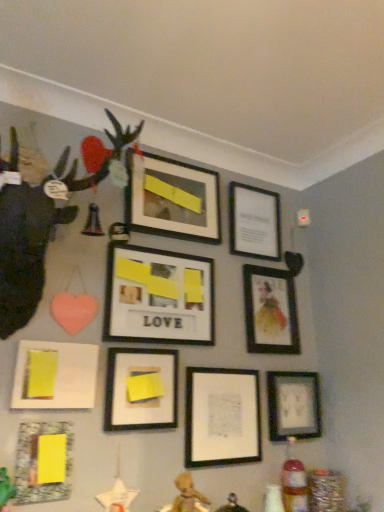
At what (x,y) coordinates should I click in order to perform the action: click on matte paper picture frame at center, which ranks as the 6th picture frame in right-to-left order. Please return your answer as a coordinate pair (x, y). The image size is (384, 512). Looking at the image, I should click on (158, 297).

The image size is (384, 512). I want to click on matte black figurine at left, so click(x=42, y=228).

From the image's perspective, which is below, matte black picture frame at upper center, the seventh picture frame viewed from the left, or matte black picture frame at center, which is counted as the 7th picture frame, starting from the right?

From the image's view, matte black picture frame at center, which is counted as the 7th picture frame, starting from the right, is below.

Considering the relative sizes of matte black picture frame at upper center, the seventh picture frame viewed from the left, and matte black picture frame at center, which is counted as the 7th picture frame, starting from the right, in the image provided, is matte black picture frame at upper center, the seventh picture frame viewed from the left, bigger than matte black picture frame at center, which is counted as the 7th picture frame, starting from the right,?

Correct, matte black picture frame at upper center, the seventh picture frame viewed from the left, is larger in size than matte black picture frame at center, which is counted as the 7th picture frame, starting from the right.

Which point is more distant from viewer, (258, 191) or (173, 370)?

The point (258, 191) is farther from the camera.

I want to click on the 6th picture frame behind when counting from the matte black picture frame at center, which is counted as the 7th picture frame, starting from the right, so click(x=254, y=222).

Is matte black figurine at left wider or thinner than matte glass picture frame at lower left, which ranks as the 9th picture frame in right-to-left order?

matte black figurine at left is wider than matte glass picture frame at lower left, which ranks as the 9th picture frame in right-to-left order.

From a real-world perspective, relative to matte glass picture frame at lower left, which ranks as the 9th picture frame in right-to-left order, is matte black figurine at left vertically above or below?

matte black figurine at left is situated higher than matte glass picture frame at lower left, which ranks as the 9th picture frame in right-to-left order, in the real world.

Are matte black figurine at left and matte glass picture frame at lower left, which ranks as the 9th picture frame in right-to-left order, beside each other?

No, matte black figurine at left is not making contact with matte glass picture frame at lower left, which ranks as the 9th picture frame in right-to-left order.

Is matte black figurine at left turned away from matte glass picture frame at lower left, which ranks as the 9th picture frame in right-to-left order?

No.

Between matte black picture frame at lower right, the ninth picture frame when ordered from left to right, and matte black picture frame at upper center, the seventh picture frame viewed from the left, which one has larger size?

With larger size is matte black picture frame at upper center, the seventh picture frame viewed from the left.

From the image's perspective, would you say matte black picture frame at lower right, which is the first picture frame in right-to-left order, is positioned over matte black picture frame at upper center, which is the 3th picture frame in right-to-left order?

No, from the image's perspective, matte black picture frame at lower right, which is the first picture frame in right-to-left order, is not on top of matte black picture frame at upper center, which is the 3th picture frame in right-to-left order.

Considering the positions of objects matte black picture frame at lower right, the ninth picture frame when ordered from left to right, and matte black picture frame at upper center, the seventh picture frame viewed from the left, in the image provided, who is in front, matte black picture frame at lower right, the ninth picture frame when ordered from left to right, or matte black picture frame at upper center, the seventh picture frame viewed from the left,?

matte black picture frame at lower right, the ninth picture frame when ordered from left to right, is closer to the camera.

Is matte black picture frame at upper center, the seventh picture frame viewed from the left, at the back of matte black picture frame at lower right, which is the first picture frame in right-to-left order?

No, matte black picture frame at lower right, which is the first picture frame in right-to-left order,'s orientation is not away from matte black picture frame at upper center, the seventh picture frame viewed from the left.

Based on their sizes in the image, would you say matte black picture frame at lower right, which is the first picture frame in right-to-left order, is bigger or smaller than matte black picture frame at center, which is the 4th picture frame in right-to-left order?

In the image, matte black picture frame at lower right, which is the first picture frame in right-to-left order, appears to be larger than matte black picture frame at center, which is the 4th picture frame in right-to-left order.

Is matte black picture frame at lower right, which is the first picture frame in right-to-left order, to the left of matte black picture frame at center, which is the 4th picture frame in right-to-left order, from the viewer's perspective?

No.

Which of these two, matte black picture frame at lower right, the ninth picture frame when ordered from left to right, or matte black picture frame at center, which is the 4th picture frame in right-to-left order, is thinner?

matte black picture frame at center, which is the 4th picture frame in right-to-left order.

What's the angular difference between matte black picture frame at lower right, the ninth picture frame when ordered from left to right, and matte black picture frame at center, arranged as the 6th picture frame when viewed from the left,'s facing directions?

The angular difference between matte black picture frame at lower right, the ninth picture frame when ordered from left to right, and matte black picture frame at center, arranged as the 6th picture frame when viewed from the left, is 0.811 degrees.

Does matte black picture frame at lower right, which is the first picture frame in right-to-left order, turn towards white matte picture frame at lower left, which is the 2th picture frame in left-to-right order?

No, matte black picture frame at lower right, which is the first picture frame in right-to-left order, is not turned towards white matte picture frame at lower left, which is the 2th picture frame in left-to-right order.

Between matte black picture frame at lower right, which is the first picture frame in right-to-left order, and white matte picture frame at lower left, which is the 2th picture frame in left-to-right order, which one has smaller width?

With smaller width is matte black picture frame at lower right, which is the first picture frame in right-to-left order.

From the image's perspective, does matte black picture frame at lower right, which is the first picture frame in right-to-left order, appear lower than white matte picture frame at lower left, which is the 2th picture frame in left-to-right order?

Correct, matte black picture frame at lower right, which is the first picture frame in right-to-left order, appears lower than white matte picture frame at lower left, which is the 2th picture frame in left-to-right order, in the image.

Could you measure the distance between matte black picture frame at upper right, placed as the 2th picture frame when sorted from right to left, and matte black picture frame at upper center, which is the 3th picture frame in right-to-left order?

matte black picture frame at upper right, placed as the 2th picture frame when sorted from right to left, is 8.75 inches away from matte black picture frame at upper center, which is the 3th picture frame in right-to-left order.

From a real-world perspective, between matte black picture frame at upper right, acting as the eighth picture frame starting from the left, and matte black picture frame at upper center, which is the 3th picture frame in right-to-left order, who is vertically higher?

In real-world perspective, matte black picture frame at upper center, which is the 3th picture frame in right-to-left order, is above.

Which object is closer to the camera taking this photo, matte black picture frame at upper right, acting as the eighth picture frame starting from the left, or matte black picture frame at upper center, the seventh picture frame viewed from the left?

matte black picture frame at upper right, acting as the eighth picture frame starting from the left.

From a real-world perspective, between matte black picture frame at center, which is counted as the 7th picture frame, starting from the right, and white matte picture frame at lower left, the 8th picture frame when ordered from right to left, who is vertically lower?

In real-world perspective, matte black picture frame at center, which is counted as the 7th picture frame, starting from the right, is lower.

Where is `the 1st picture frame to the right of the white matte picture frame at lower left, which is the 2th picture frame in left-to-right order, starting your count from the anchor`? Image resolution: width=384 pixels, height=512 pixels. the 1st picture frame to the right of the white matte picture frame at lower left, which is the 2th picture frame in left-to-right order, starting your count from the anchor is located at coordinates (141, 399).

Between matte black picture frame at center, which is the third picture frame in left-to-right order, and white matte picture frame at lower left, which is the 2th picture frame in left-to-right order, which one has larger width?

white matte picture frame at lower left, which is the 2th picture frame in left-to-right order, is wider.

Locate an element on the screen. The height and width of the screenshot is (512, 384). picture frame that is the 4th object above the matte black picture frame at center, which is the third picture frame in left-to-right order (from a real-world perspective) is located at coordinates (254, 222).

I want to click on the 2nd picture frame to the left when counting from the matte black figurine at left, so click(43, 462).

Looking at the image, which one is located closer to matte black picture frame at upper center, which is the 3th picture frame in right-to-left order, matte black picture frame at center, which is the 4th picture frame in right-to-left order, or matte glass picture frame at lower left, which ranks as the 9th picture frame in right-to-left order?

Based on the image, matte black picture frame at center, which is the 4th picture frame in right-to-left order, appears to be nearer to matte black picture frame at upper center, which is the 3th picture frame in right-to-left order.

When comparing their distances from matte black figurine at left, does matte black picture frame at upper center, the 5th picture frame in the right-to-left sequence, or matte black picture frame at center, which is the third picture frame in left-to-right order, seem closer?

matte black picture frame at upper center, the 5th picture frame in the right-to-left sequence, lies closer to matte black figurine at left than the other object.

Estimate the real-world distances between objects in this image. Which object is closer to matte black picture frame at lower right, which is the first picture frame in right-to-left order, matte paper picture frame at center, which ranks as the 6th picture frame in right-to-left order, or white matte picture frame at lower left, the 8th picture frame when ordered from right to left?

matte paper picture frame at center, which ranks as the 6th picture frame in right-to-left order, lies closer to matte black picture frame at lower right, which is the first picture frame in right-to-left order, than the other object.

Estimate the real-world distances between objects in this image. Which object is further from matte black picture frame at center, which is counted as the 7th picture frame, starting from the right, matte black picture frame at upper center, which is the 3th picture frame in right-to-left order, or matte black picture frame at center, arranged as the 6th picture frame when viewed from the left?

matte black picture frame at upper center, which is the 3th picture frame in right-to-left order, is further to matte black picture frame at center, which is counted as the 7th picture frame, starting from the right.

Based on their spatial positions, is matte black picture frame at upper center, which is the 3th picture frame in right-to-left order, or matte glass picture frame at lower left, which ranks as the 9th picture frame in right-to-left order, closer to matte black picture frame at lower right, the ninth picture frame when ordered from left to right?

The object closer to matte black picture frame at lower right, the ninth picture frame when ordered from left to right, is matte black picture frame at upper center, which is the 3th picture frame in right-to-left order.

From the image, which object appears to be nearer to matte glass picture frame at lower left, which ranks as the 9th picture frame in right-to-left order, matte black picture frame at center, which is counted as the 7th picture frame, starting from the right, or matte black figurine at left?

Based on the image, matte black picture frame at center, which is counted as the 7th picture frame, starting from the right, appears to be nearer to matte glass picture frame at lower left, which ranks as the 9th picture frame in right-to-left order.

Estimate the real-world distances between objects in this image. Which object is further from matte glass picture frame at lower left, which ranks as the 9th picture frame in right-to-left order, white matte picture frame at lower left, the 8th picture frame when ordered from right to left, or matte black picture frame at upper right, acting as the eighth picture frame starting from the left?

The object further to matte glass picture frame at lower left, which ranks as the 9th picture frame in right-to-left order, is matte black picture frame at upper right, acting as the eighth picture frame starting from the left.

Looking at the image, which one is located closer to white matte picture frame at lower left, which is the 2th picture frame in left-to-right order, matte black picture frame at upper center, the seventh picture frame viewed from the left, or matte black picture frame at upper right, placed as the 2th picture frame when sorted from right to left?

matte black picture frame at upper right, placed as the 2th picture frame when sorted from right to left, is closer to white matte picture frame at lower left, which is the 2th picture frame in left-to-right order.

Identify the location of toy between matte black picture frame at upper center, the 5th picture frame in the right-to-left sequence, and matte glass picture frame at lower left, which ranks as the 9th picture frame in right-to-left order, vertically. The image size is (384, 512). (42, 228).

Where is `toy between matte black picture frame at upper center, the 5th picture frame in the right-to-left sequence, and matte black picture frame at center, which is counted as the 7th picture frame, starting from the right, in the vertical direction`? This screenshot has width=384, height=512. toy between matte black picture frame at upper center, the 5th picture frame in the right-to-left sequence, and matte black picture frame at center, which is counted as the 7th picture frame, starting from the right, in the vertical direction is located at coordinates (42, 228).

Locate an element on the screen. picture frame between white matte picture frame at lower left, which is the 2th picture frame in left-to-right order, and matte paper picture frame at center, which ranks as the 6th picture frame in right-to-left order, from left to right is located at coordinates (141, 399).

Where is `toy between white matte picture frame at lower left, which is the 2th picture frame in left-to-right order, and matte black picture frame at upper right, placed as the 2th picture frame when sorted from right to left, in the horizontal direction`? This screenshot has width=384, height=512. toy between white matte picture frame at lower left, which is the 2th picture frame in left-to-right order, and matte black picture frame at upper right, placed as the 2th picture frame when sorted from right to left, in the horizontal direction is located at coordinates (42, 228).